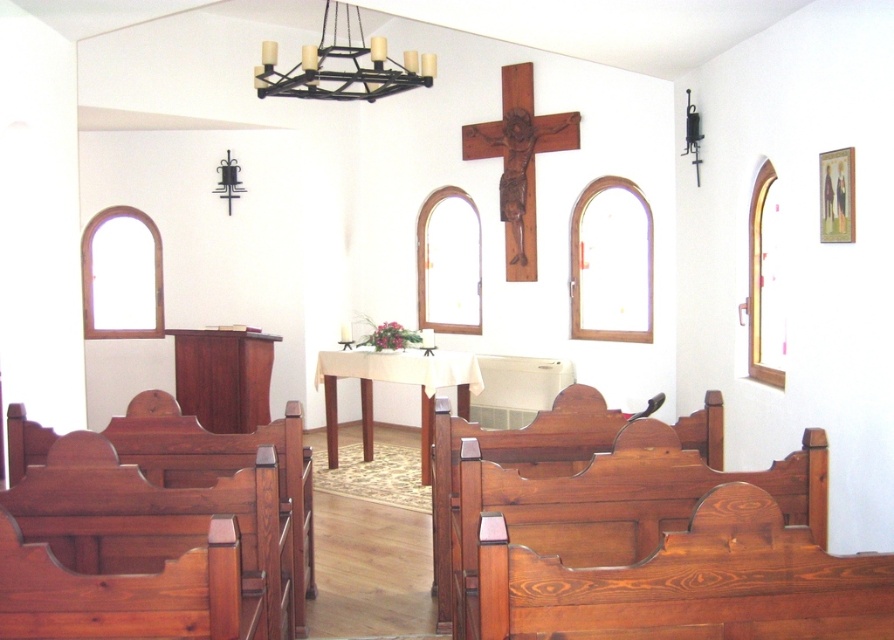
Does polished wood church bench at lower left have a lesser width compared to wooden crucifix at center?

Incorrect, polished wood church bench at lower left's width is not less than wooden crucifix at center's.

Is polished wood church bench at lower left wider than wooden crucifix at center?

Indeed, polished wood church bench at lower left has a greater width compared to wooden crucifix at center.

Which is behind, point (294, 538) or point (529, 173)?

The point (529, 173) is more distant.

Locate an element on the screen. This screenshot has width=894, height=640. polished wood church bench at lower left is located at coordinates (171, 497).

Does wooden crucifix at center have a lesser height compared to black metal chandelier at upper center?

No.

Is point (504, 170) closer to camera compared to point (428, 60)?

No, it is not.

You are a GUI agent. You are given a task and a screenshot of the screen. Output one action in this format:
    pyautogui.click(x=<x>, y=<y>)
    Task: Click on the wooden crucifix at center
    
    Given the screenshot: What is the action you would take?
    pyautogui.click(x=519, y=161)

Does polished wood church bench at lower right appear under black metal chandelier at upper center?

Correct, polished wood church bench at lower right is located below black metal chandelier at upper center.

Does point (558, 568) come behind point (409, 80)?

No, (558, 568) is closer to viewer.

Between point (521, 467) and point (270, 52), which one is positioned behind?

The point (270, 52) is behind.

The width and height of the screenshot is (894, 640). What are the coordinates of `polished wood church bench at lower right` in the screenshot? It's located at (639, 538).